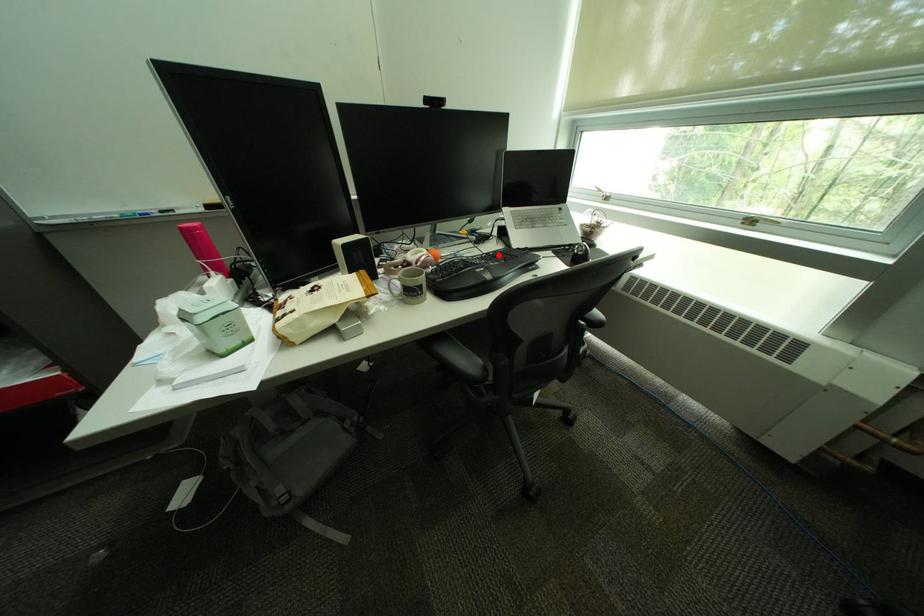
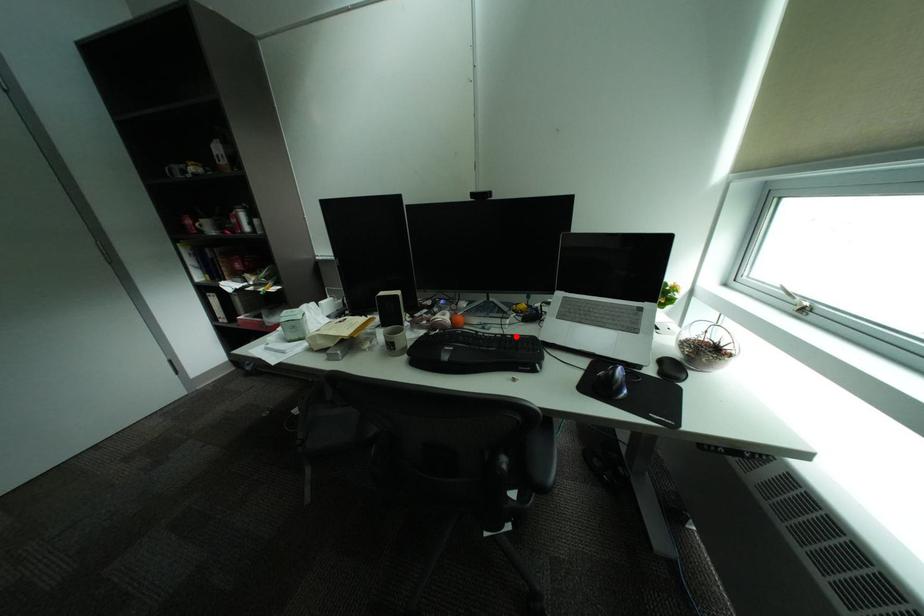
I am providing you with two images of the same scene from different viewpoints. A red point is marked on the first image and another point is marked on the second image. Does the point marked in image1 correspond to the same location as the one in image2?

Yes